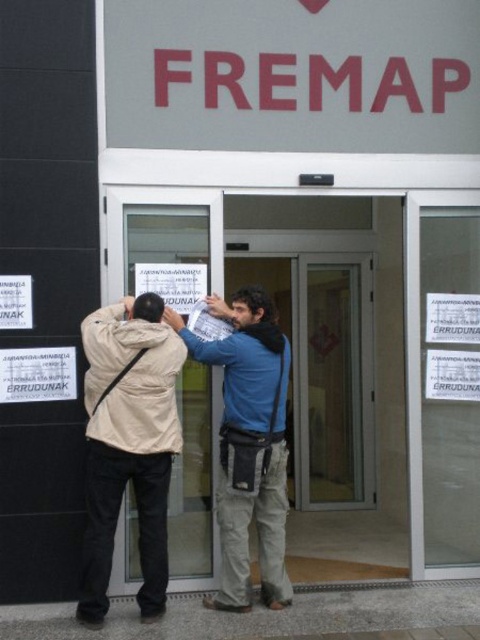
You are standing at the entrance of the building and want to touch both points on the wall. Which point should you reach for first, point at (362, 83) or point at (132, 348)?

You should reach for point at (362, 83) first because it is closer to you than point at (132, 348).